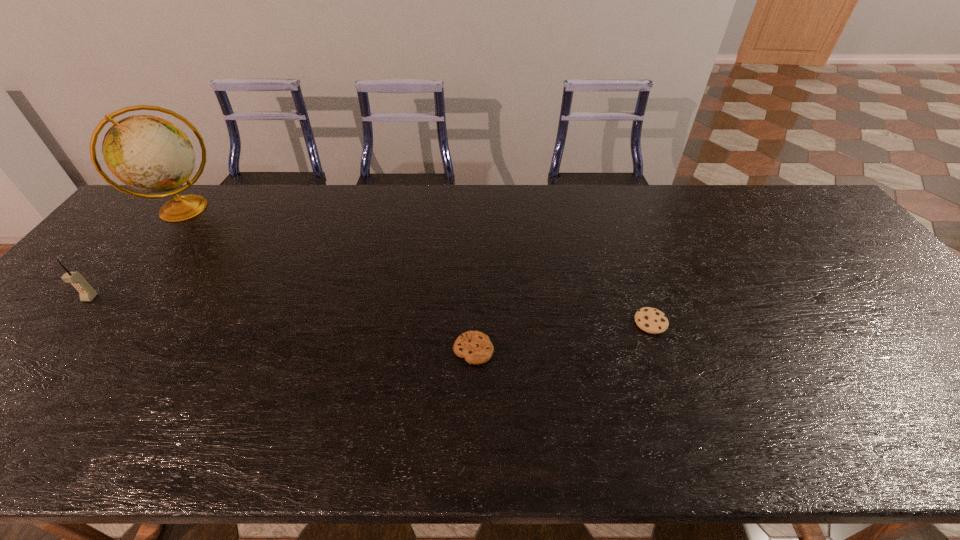
The image size is (960, 540). What are the coordinates of `object situated at the far edge` in the screenshot? It's located at (150, 154).

The image size is (960, 540). What are the coordinates of `globe present at the left edge` in the screenshot? It's located at (150, 154).

Where is `cellular telephone located in the left edge section of the desktop`? The width and height of the screenshot is (960, 540). cellular telephone located in the left edge section of the desktop is located at coordinates (86, 292).

Identify the location of object that is positioned at the far left corner. Image resolution: width=960 pixels, height=540 pixels. (150, 154).

The image size is (960, 540). In order to click on vacant space at the far edge of the desktop in this screenshot , I will do `click(459, 227)`.

You are a GUI agent. You are given a task and a screenshot of the screen. Output one action in this format:
    pyautogui.click(x=<x>, y=<y>)
    Task: Click on the free space at the near edge of the desktop
    
    Given the screenshot: What is the action you would take?
    pyautogui.click(x=189, y=445)

In the image, there is a desktop. Where is `vacant area at the left edge`? The height and width of the screenshot is (540, 960). vacant area at the left edge is located at coordinates (9, 353).

The width and height of the screenshot is (960, 540). Find the location of `free space at the far left corner of the desktop`. free space at the far left corner of the desktop is located at coordinates (194, 187).

Find the location of a particular element. This screenshot has width=960, height=540. free space between the rightmost object and the second object from right to left is located at coordinates (562, 336).

I want to click on free point between the second tallest object and the left cookie, so click(x=281, y=324).